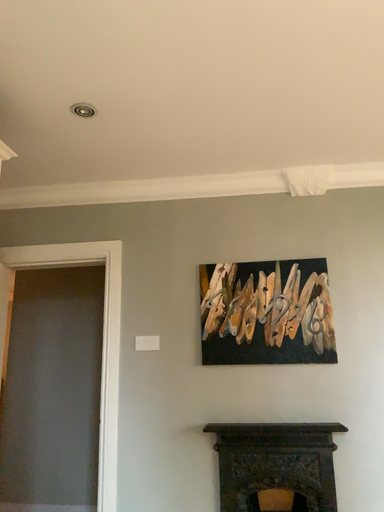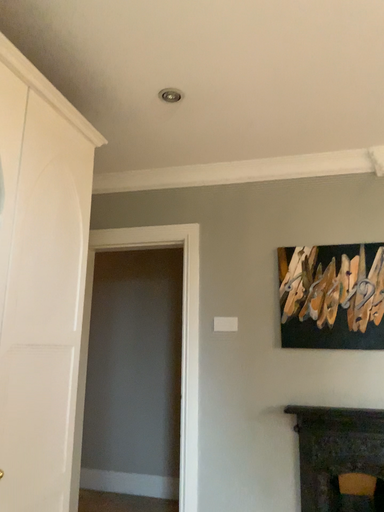
Question: How did the camera likely rotate when shooting the video?

Choices:
 (A) rotated right
 (B) rotated left

Answer: (B)